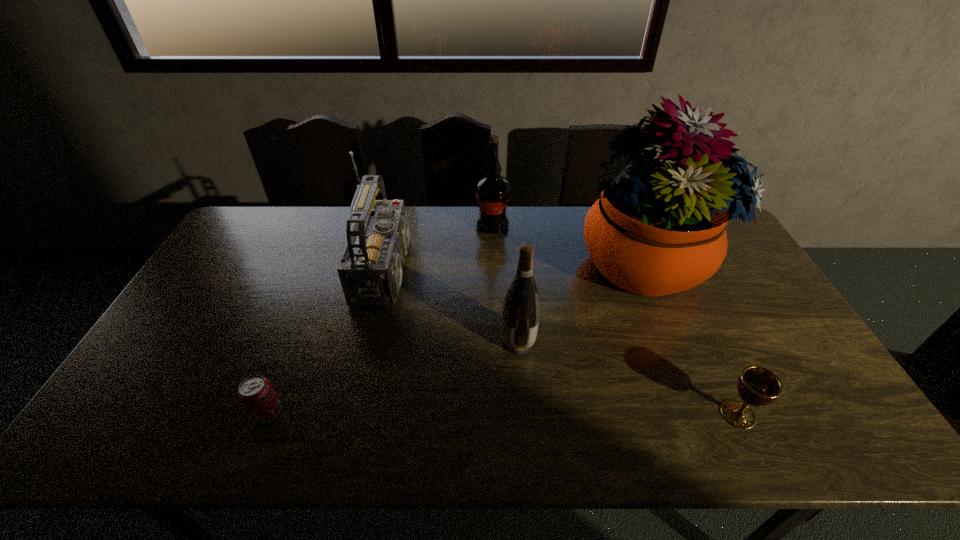
Identify the location of the tallest object. Image resolution: width=960 pixels, height=540 pixels. (658, 228).

Find the location of `the farther wine bottle`. the farther wine bottle is located at coordinates (492, 191).

The height and width of the screenshot is (540, 960). What are the coordinates of `radio receiver` in the screenshot? It's located at (370, 270).

The image size is (960, 540). Identify the location of the nearer wine bottle. (521, 309).

At what (x,y) coordinates should I click in order to perform the action: click on the fifth tallest object. Please return your answer as a coordinate pair (x, y). The width and height of the screenshot is (960, 540). Looking at the image, I should click on (757, 386).

Identify the location of soda. The width and height of the screenshot is (960, 540). (257, 395).

What are the coordinates of `the leftmost object` in the screenshot? It's located at (257, 395).

Image resolution: width=960 pixels, height=540 pixels. Find the location of `vacant space located 0.050m on the back of the tallest object`. vacant space located 0.050m on the back of the tallest object is located at coordinates (620, 212).

You are a GUI agent. You are given a task and a screenshot of the screen. Output one action in this format:
    pyautogui.click(x=<x>, y=<y>)
    Task: Click on the free region located 0.270m on the left of the farther wine bottle
    
    Given the screenshot: What is the action you would take?
    pyautogui.click(x=400, y=226)

Where is `free space located on the front-facing side of the radio receiver`? The image size is (960, 540). free space located on the front-facing side of the radio receiver is located at coordinates (540, 269).